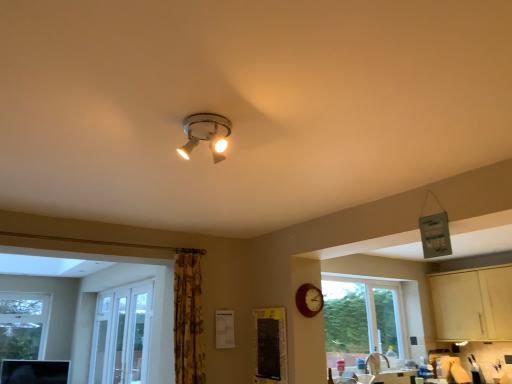
Question: Considering the relative sizes of yellow floral fabric curtain at center-left and wooden clock at lower right in the image provided, is yellow floral fabric curtain at center-left thinner than wooden clock at lower right?

Choices:
 (A) yes
 (B) no

Answer: (B)

Question: From the image's perspective, does yellow floral fabric curtain at center-left appear higher than wooden clock at lower right?

Choices:
 (A) yes
 (B) no

Answer: (B)

Question: Can you confirm if yellow floral fabric curtain at center-left is bigger than wooden clock at lower right?

Choices:
 (A) yes
 (B) no

Answer: (A)

Question: Considering the relative sizes of yellow floral fabric curtain at center-left and wooden clock at lower right in the image provided, is yellow floral fabric curtain at center-left smaller than wooden clock at lower right?

Choices:
 (A) no
 (B) yes

Answer: (A)

Question: Could you tell me if yellow floral fabric curtain at center-left is facing wooden clock at lower right?

Choices:
 (A) no
 (B) yes

Answer: (A)

Question: Looking at the image, does wooden clock at lower right seem bigger or smaller compared to light wood cabinet at lower right?

Choices:
 (A) big
 (B) small

Answer: (B)

Question: From the image's perspective, is wooden clock at lower right located above or below light wood cabinet at lower right?

Choices:
 (A) below
 (B) above

Answer: (B)

Question: From a real-world perspective, is wooden clock at lower right physically located above or below light wood cabinet at lower right?

Choices:
 (A) below
 (B) above

Answer: (A)

Question: In the image, is wooden clock at lower right positioned in front of or behind light wood cabinet at lower right?

Choices:
 (A) behind
 (B) front

Answer: (B)

Question: Considering the positions of point (183, 274) and point (269, 349), is point (183, 274) closer or farther from the camera than point (269, 349)?

Choices:
 (A) farther
 (B) closer

Answer: (A)

Question: Looking at their shapes, would you say yellow floral fabric curtain at center-left is wider or thinner than black fabric bulletin board at lower center?

Choices:
 (A) wide
 (B) thin

Answer: (A)

Question: From a real-world perspective, is yellow floral fabric curtain at center-left positioned above or below black fabric bulletin board at lower center?

Choices:
 (A) above
 (B) below

Answer: (A)

Question: Would you say yellow floral fabric curtain at center-left is to the left or to the right of black fabric bulletin board at lower center in the picture?

Choices:
 (A) left
 (B) right

Answer: (A)

Question: From a real-world perspective, is black fabric bulletin board at lower center physically located above or below matte silver spotlight at upper center?

Choices:
 (A) below
 (B) above

Answer: (A)

Question: Is black fabric bulletin board at lower center to the left or to the right of matte silver spotlight at upper center in the image?

Choices:
 (A) right
 (B) left

Answer: (A)